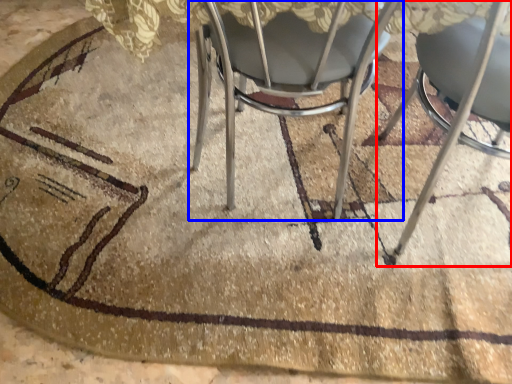
Question: Which point is closer to the camera, chair (highlighted by a red box) or chair (highlighted by a blue box)?

Choices:
 (A) chair
 (B) chair

Answer: (A)